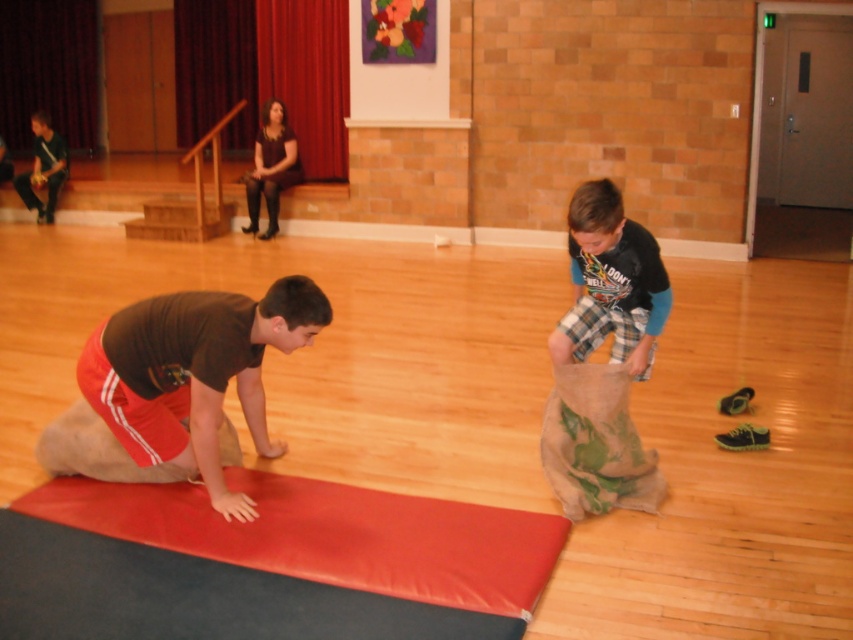
You are organizing a sports event and need to place the matte brown shorts at lower left and the matte black guitar at left in a storage locker. The locker has a shelf that can only hold items smaller than the guitar. Can both items fit on the shelf?

The matte brown shorts at lower left is larger in size than the matte black guitar at left. Since the shelf can only hold items smaller than the guitar, neither the shorts nor the guitar can fit on the shelf because the shorts are larger than the guitar, and the guitar itself exceeds the size limit.

In the scene shown: You are standing at the center of the gymnasium and see a point marked at coordinates (180, 387). What object is located at that exact point?

The object located at point (180, 387) is the matte brown shorts at lower left.

You are organizing a sports event and need to ensure participants have enough space. Based on the image, which participant, the one wearing the matte brown shorts at lower left or the one in plaid fabric pants at right, has wider clothing in the lower body area?

The matte brown shorts at lower left has a greater width than the plaid fabric pants at right, so the participant in the matte brown shorts at lower left has wider clothing in the lower body area.